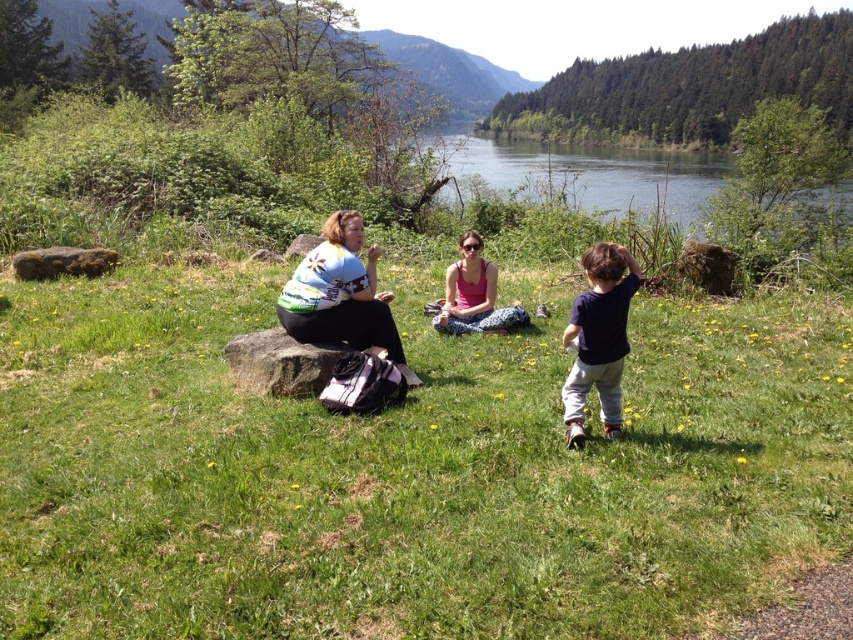
From the picture: Between matte floral shirt at center and brown rough rock at left, which one has less height?

brown rough rock at left is shorter.

Does point (297, 269) come farther from viewer compared to point (94, 262)?

No, it is in front of (94, 262).

Identify the location of matte floral shirt at center. (339, 292).

Can you confirm if pink fabric at center is positioned below brown rough rock at left?

Yes, pink fabric at center is below brown rough rock at left.

Between point (460, 330) and point (74, 273), which one is positioned in front?

Point (460, 330)

Which is behind, point (471, 282) or point (86, 257)?

The point (86, 257) is more distant.

The width and height of the screenshot is (853, 640). Identify the location of pink fabric at center. (474, 294).

Can you confirm if matte floral shirt at center is shorter than dark blue t-shirt at right?

Yes, matte floral shirt at center is shorter than dark blue t-shirt at right.

Find the location of a particular element. matte floral shirt at center is located at coordinates (339, 292).